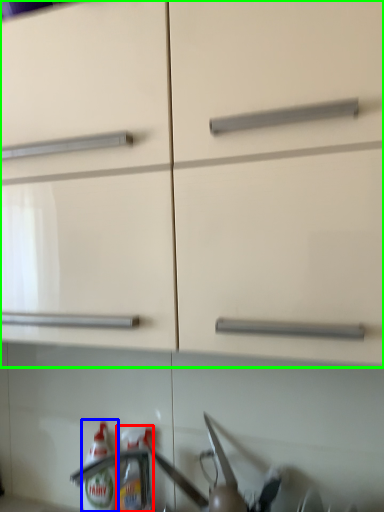
Question: Estimate the real-world distances between objects in this image. Which object is farther from bottle (highlighted by a red box), bottle (highlighted by a blue box) or cabinetry (highlighted by a green box)?

Choices:
 (A) bottle
 (B) cabinetry

Answer: (B)